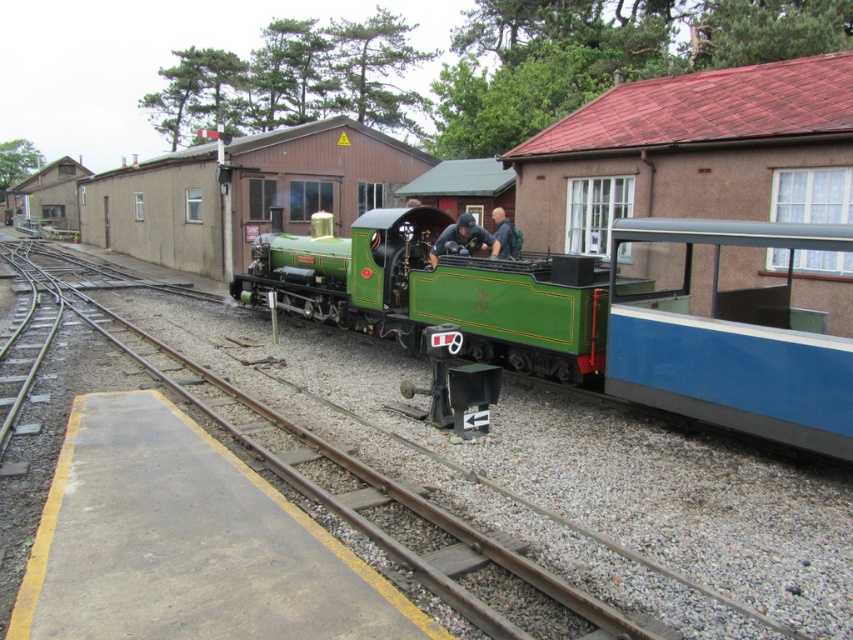
Between point (618, 320) and point (512, 236), which one is positioned in front?

Point (618, 320)

Is green polished wood train at center behind dark blue shirt at center?

No, green polished wood train at center is closer to the viewer.

Image resolution: width=853 pixels, height=640 pixels. What are the coordinates of `green polished wood train at center` in the screenshot? It's located at (595, 314).

Is matte green locomotive at center thinner than dark blue shirt at center?

No, matte green locomotive at center is not thinner than dark blue shirt at center.

Which is more to the right, matte green locomotive at center or dark blue shirt at center?

dark blue shirt at center

Where is `matte green locomotive at center`? The width and height of the screenshot is (853, 640). matte green locomotive at center is located at coordinates (462, 240).

Find the location of a particular element. matte green locomotive at center is located at coordinates (462, 240).

Is green polished wood train at center below matte green locomotive at center?

Yes, green polished wood train at center is below matte green locomotive at center.

Can you confirm if green polished wood train at center is positioned to the right of matte green locomotive at center?

Indeed, green polished wood train at center is positioned on the right side of matte green locomotive at center.

Is point (708, 228) less distant than point (486, 241)?

Yes, point (708, 228) is in front of point (486, 241).

This screenshot has width=853, height=640. What are the coordinates of `green polished wood train at center` in the screenshot? It's located at (595, 314).